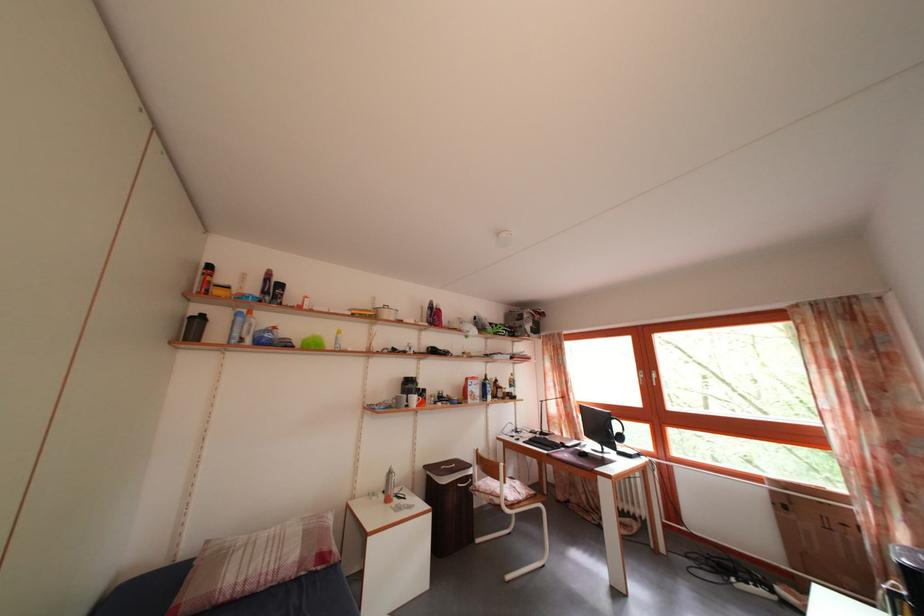
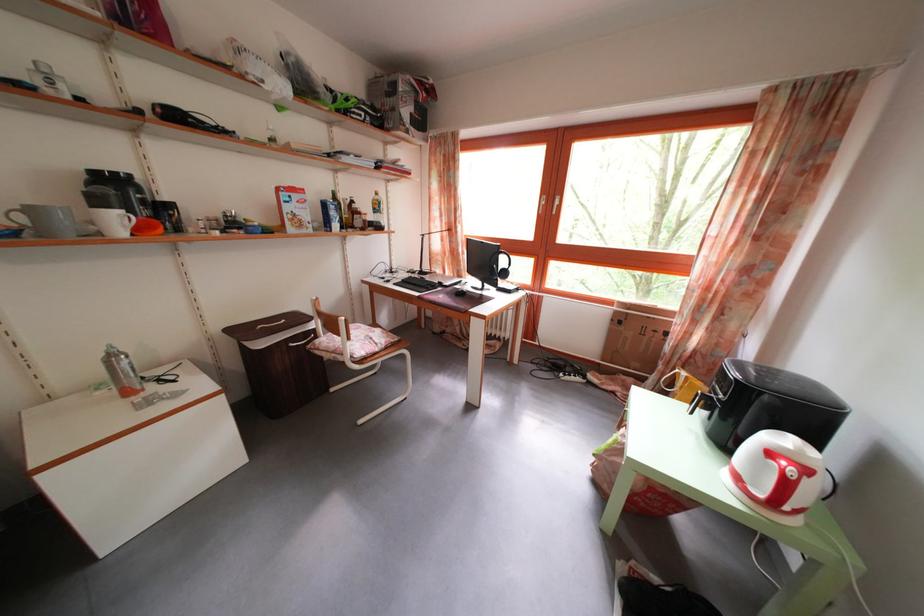
Locate, in the second image, the point that corresponds to point 418,514 in the first image.

(185, 402)